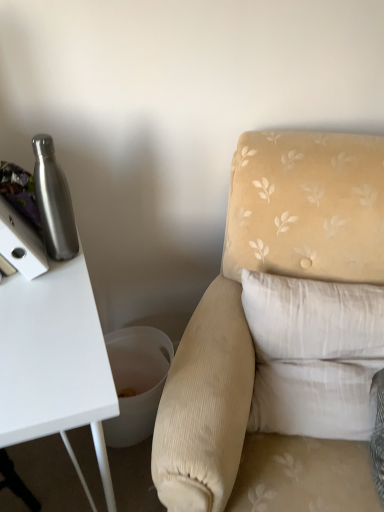
What do you see at coordinates (263, 271) in the screenshot? The width and height of the screenshot is (384, 512). I see `velvet beige armchair at center` at bounding box center [263, 271].

Where is `velvet beige armchair at center`? This screenshot has width=384, height=512. velvet beige armchair at center is located at coordinates (263, 271).

How distant is white cotton pillow at right from velvet beige armchair at center?

white cotton pillow at right is 6.00 inches away from velvet beige armchair at center.

Is velvet beige armchair at center at the back of white cotton pillow at right?

Yes, velvet beige armchair at center is at the back of white cotton pillow at right.

Considering the relative sizes of white cotton pillow at right and velvet beige armchair at center in the image provided, is white cotton pillow at right thinner than velvet beige armchair at center?

Correct, the width of white cotton pillow at right is less than that of velvet beige armchair at center.

Is point (306, 365) farther from camera compared to point (191, 414)?

Yes, it is.

Does velvet beige armchair at center turn towards brushed metal water bottle at left?

No, velvet beige armchair at center is not oriented towards brushed metal water bottle at left.

Does point (235, 406) appear closer or farther from the camera than point (70, 217)?

Point (235, 406).

Based on the photo, between velvet beige armchair at center and brushed metal water bottle at left, which one is positioned behind?

brushed metal water bottle at left is further from the camera.

Is velvet beige armchair at center smaller than brushed metal water bottle at left?

Actually, velvet beige armchair at center might be larger than brushed metal water bottle at left.

From a real-world perspective, is white cotton pillow at right positioned over brushed metal water bottle at left based on gravity?

No.

Is white cotton pillow at right not within brushed metal water bottle at left?

Yes, white cotton pillow at right is not within brushed metal water bottle at left.

Between white cotton pillow at right and brushed metal water bottle at left, which one has smaller size?

Smaller between the two is brushed metal water bottle at left.

Image resolution: width=384 pixels, height=512 pixels. What are the coordinates of `bottle located behind the velvet beige armchair at center` in the screenshot? It's located at (54, 201).

Considering their positions, is brushed metal water bottle at left located in front of or behind velvet beige armchair at center?

Clearly, brushed metal water bottle at left is behind velvet beige armchair at center.

From a real-world perspective, which is physically below, brushed metal water bottle at left or velvet beige armchair at center?

velvet beige armchair at center is physically lower.

Is velvet beige armchair at center located within brushed metal water bottle at left?

No, velvet beige armchair at center is located outside of brushed metal water bottle at left.

From a real-world perspective, who is located lower, brushed metal water bottle at left or white cotton pillow at right?

In real-world perspective, white cotton pillow at right is lower.

In the scene shown: Is brushed metal water bottle at left oriented away from white cotton pillow at right?

brushed metal water bottle at left does not have its back to white cotton pillow at right.

Is point (60, 202) in front of point (337, 394)?

Yes, point (60, 202) is closer to viewer.

From the image's perspective, does brushed metal water bottle at left appear higher than white cotton pillow at right?

Yes, from the image's perspective, brushed metal water bottle at left is on top of white cotton pillow at right.

Between velvet beige armchair at center and white cotton pillow at right, which one has smaller width?

white cotton pillow at right is thinner.

Which is closer to the camera, (x=251, y=206) or (x=339, y=351)?

The point (x=339, y=351) is closer to the camera.

From the image's perspective, which one is positioned lower, velvet beige armchair at center or white cotton pillow at right?

From the image's view, velvet beige armchair at center is below.

Considering the positions of objects velvet beige armchair at center and white cotton pillow at right in the image provided, who is behind, velvet beige armchair at center or white cotton pillow at right?

white cotton pillow at right is further from the camera.

The height and width of the screenshot is (512, 384). I want to click on chair beneath the white cotton pillow at right (from a real-world perspective), so click(263, 271).

The image size is (384, 512). Identify the location of bottle above the velvet beige armchair at center (from the image's perspective). (54, 201).

Looking at the image, which one is located further to velvet beige armchair at center, brushed metal water bottle at left or white cotton pillow at right?

Based on the image, brushed metal water bottle at left appears to be further to velvet beige armchair at center.

From the image, which object appears to be farther from white cotton pillow at right, brushed metal water bottle at left or velvet beige armchair at center?

The object further to white cotton pillow at right is brushed metal water bottle at left.

Looking at the image, which one is located closer to brushed metal water bottle at left, velvet beige armchair at center or white cotton pillow at right?

Based on the image, velvet beige armchair at center appears to be nearer to brushed metal water bottle at left.

Based on the photo, from the image, which object appears to be nearer to velvet beige armchair at center, white cotton pillow at right or brushed metal water bottle at left?

Among the two, white cotton pillow at right is located nearer to velvet beige armchair at center.

Estimate the real-world distances between objects in this image. Which object is closer to brushed metal water bottle at left, white cotton pillow at right or velvet beige armchair at center?

Based on the image, velvet beige armchair at center appears to be nearer to brushed metal water bottle at left.

Estimate the real-world distances between objects in this image. Which object is closer to white cotton pillow at right, velvet beige armchair at center or brushed metal water bottle at left?

velvet beige armchair at center lies closer to white cotton pillow at right than the other object.

Find the location of a particular element. The image size is (384, 512). chair located between brushed metal water bottle at left and white cotton pillow at right in the left-right direction is located at coordinates (263, 271).